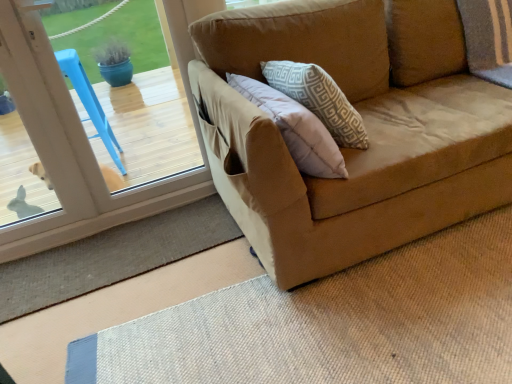
Question: In terms of height, does transparent glass door at left look taller or shorter compared to burlap mat at lower left?

Choices:
 (A) short
 (B) tall

Answer: (B)

Question: Relative to burlap mat at lower left, is transparent glass door at left in front or behind?

Choices:
 (A) front
 (B) behind

Answer: (A)

Question: Would you say transparent glass door at left is inside or outside burlap mat at lower left?

Choices:
 (A) outside
 (B) inside

Answer: (A)

Question: Is point (32, 297) positioned closer to the camera than point (10, 135)?

Choices:
 (A) farther
 (B) closer

Answer: (B)

Question: From the image's perspective, relative to transparent glass door at left, is burlap mat at lower left above or below?

Choices:
 (A) above
 (B) below

Answer: (B)

Question: Looking at the image, does burlap mat at lower left seem bigger or smaller compared to transparent glass door at left?

Choices:
 (A) big
 (B) small

Answer: (B)

Question: Relative to transparent glass door at left, is burlap mat at lower left in front or behind?

Choices:
 (A) behind
 (B) front

Answer: (A)